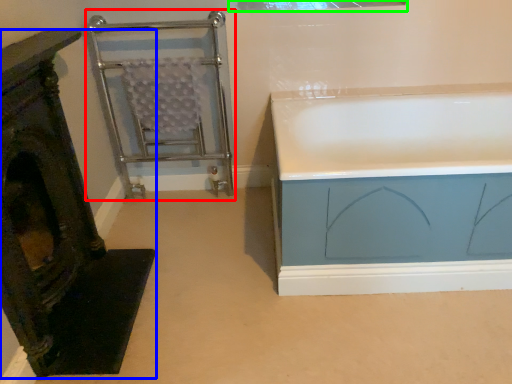
Question: Which object is the farthest from cage (highlighted by a red box)? Choose among these: furniture (highlighted by a blue box) or window (highlighted by a green box).

Choices:
 (A) furniture
 (B) window

Answer: (A)